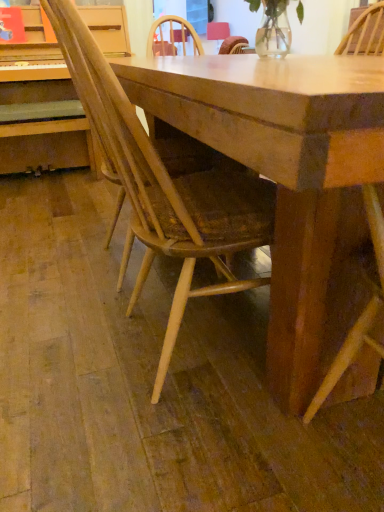
Question: Should I look upward or downward to see light brown wooden chair at center?

Choices:
 (A) up
 (B) down

Answer: (A)